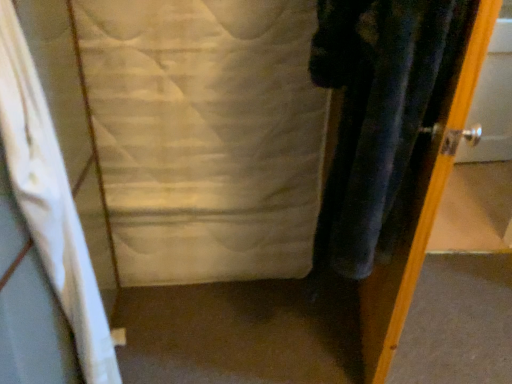
Locate an element on the screen. The width and height of the screenshot is (512, 384). vacant region to the left of metallic silver door at right is located at coordinates (293, 326).